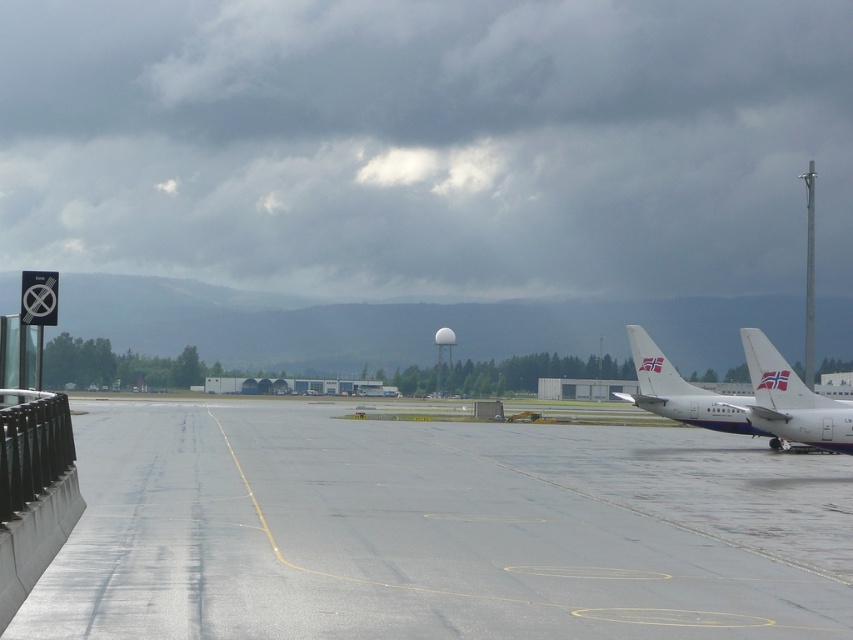
Is smooth asphalt runway at center to the right of white matte airplane at right from the viewer's perspective?

No, smooth asphalt runway at center is not to the right of white matte airplane at right.

Locate an element on the screen. The width and height of the screenshot is (853, 640). smooth asphalt runway at center is located at coordinates (436, 531).

I want to click on smooth asphalt runway at center, so click(x=436, y=531).